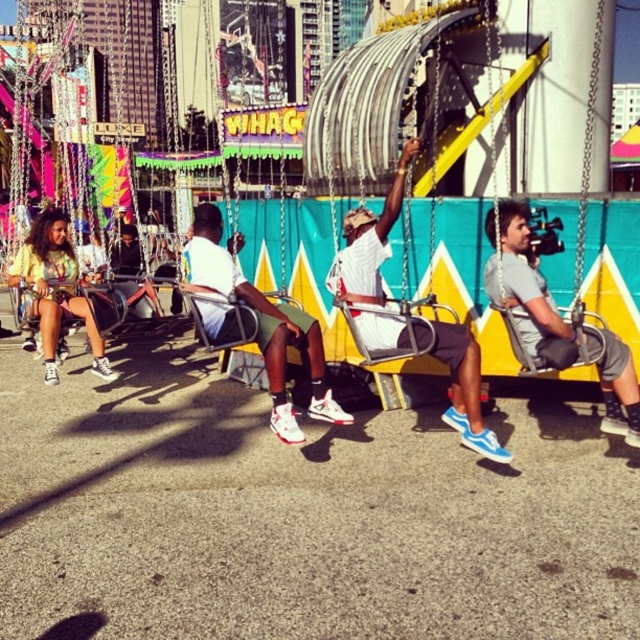
Does gray fabric shorts at center have a greater height compared to yellow-green jersey at left?

Yes.

Consider the image. Who is shorter, gray fabric shorts at center or yellow-green jersey at left?

yellow-green jersey at left

Where is `gray fabric shorts at center`? gray fabric shorts at center is located at coordinates (524, 285).

Does white matte shirt at center have a greater width compared to matte gray swing at center?

No, white matte shirt at center is not wider than matte gray swing at center.

Which is behind, point (483, 442) or point (493, 144)?

Positioned behind is point (493, 144).

You are a GUI agent. You are given a task and a screenshot of the screen. Output one action in this format:
    pyautogui.click(x=<x>, y=<y>)
    Task: Click on the white matte shirt at center
    The height and width of the screenshot is (640, 640).
    Given the screenshot: What is the action you would take?
    pyautogui.click(x=369, y=241)

Between point (284, 317) and point (504, 227), which one is positioned behind?

The point (284, 317) is behind.

Which is more to the right, white matte sneakers at center or gray fabric shorts at center?

gray fabric shorts at center is more to the right.

Find the location of a particular element. The image size is (640, 640). white matte sneakers at center is located at coordinates (262, 324).